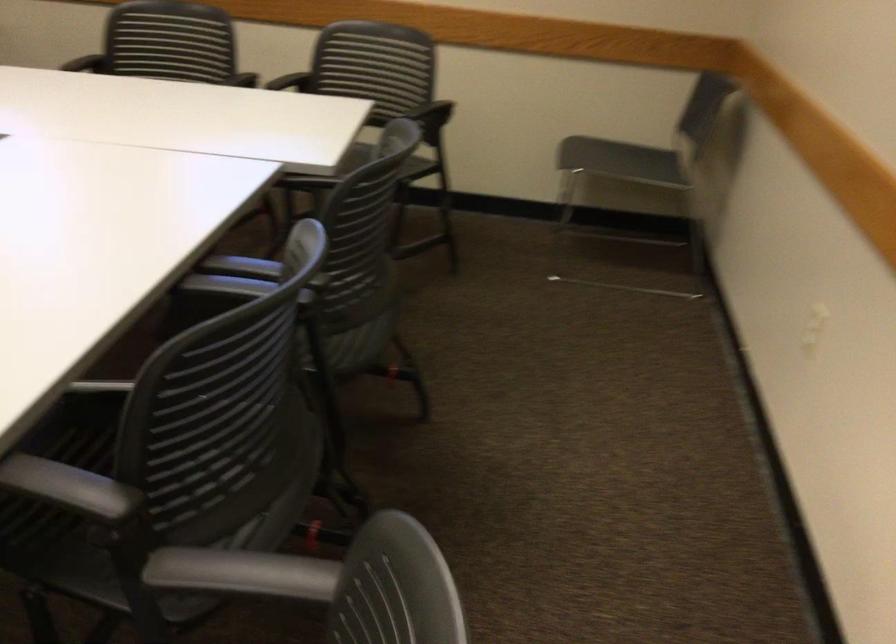
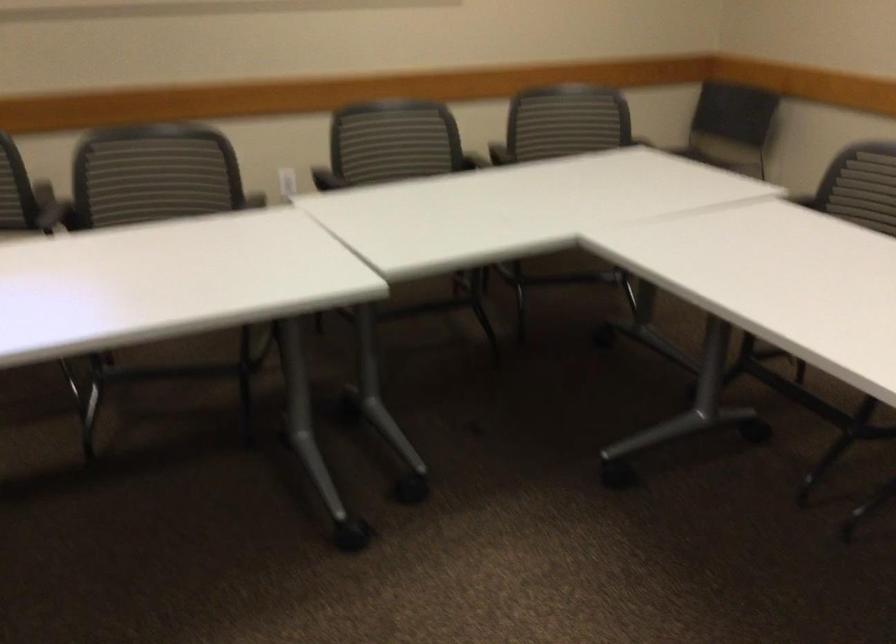
Question: I am providing you with two images of the same scene from different viewpoints. After the viewpoint changes to image2, which objects are now occluded?

Choices:
 (A) chair armrest
 (B) black chair armrest
 (C) yellow neck pillow
 (D) chair sitting surface

Answer: (B)